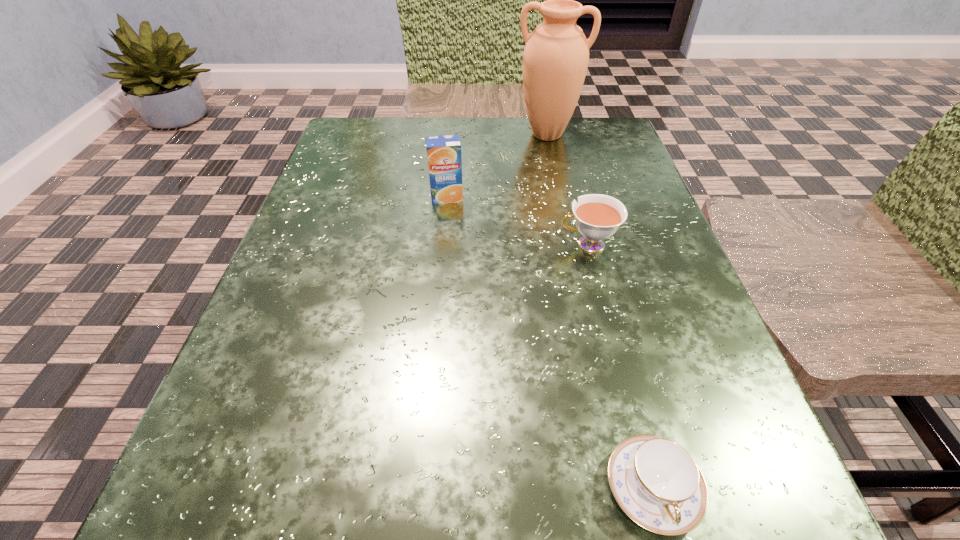
The image size is (960, 540). I want to click on urn, so click(x=556, y=55).

Find the location of a particular element. Image resolution: width=960 pixels, height=540 pixels. the farthest object is located at coordinates (556, 55).

At what (x,y) coordinates should I click in order to perform the action: click on the third nearest object. Please return your answer as a coordinate pair (x, y). The image size is (960, 540). Looking at the image, I should click on (444, 152).

Find the location of a particular element. The height and width of the screenshot is (540, 960). orange_juice is located at coordinates (444, 152).

What are the coordinates of `the farther teacup` in the screenshot? It's located at (597, 216).

In order to click on the taller teacup in this screenshot , I will do (x=597, y=216).

Where is `vacant space located on the front of the farthest object`? The width and height of the screenshot is (960, 540). vacant space located on the front of the farthest object is located at coordinates (571, 251).

Find the location of `free region located on the front of the third shortest object`. free region located on the front of the third shortest object is located at coordinates (433, 356).

Where is `free spot located 0.360m on the side of the second nearest object with the handle`? free spot located 0.360m on the side of the second nearest object with the handle is located at coordinates (342, 244).

The image size is (960, 540). Find the location of `free space located 0.220m on the side of the second nearest object with the handle`. free space located 0.220m on the side of the second nearest object with the handle is located at coordinates (426, 244).